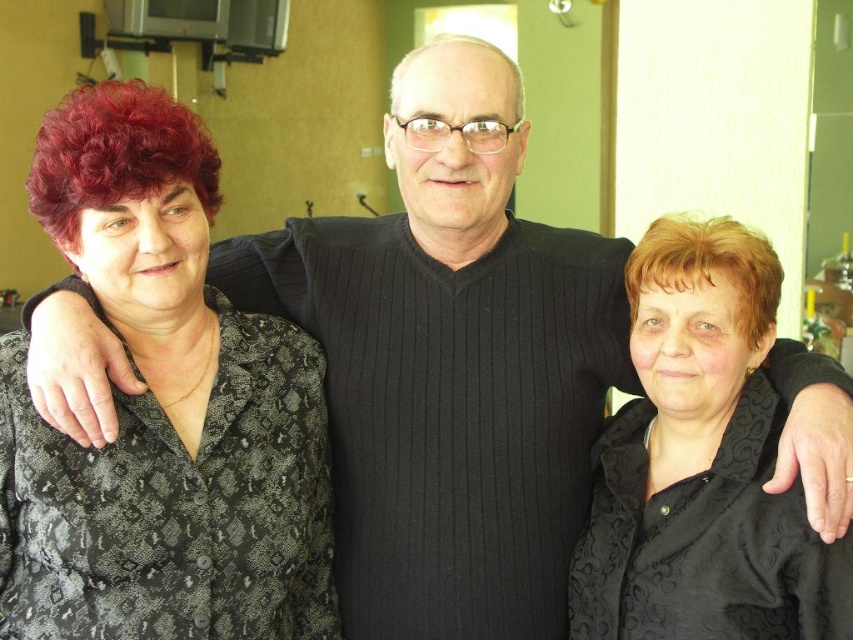
Question: Is black textured blouse at left to the right of black textured blouse at right from the viewer's perspective?

Choices:
 (A) no
 (B) yes

Answer: (A)

Question: Among these points, which one is farthest from the camera?

Choices:
 (A) coord(775,573)
 (B) coord(177,483)

Answer: (B)

Question: Is black textured blouse at left wider than black textured blouse at right?

Choices:
 (A) no
 (B) yes

Answer: (B)

Question: Which of the following is the farthest from the observer?

Choices:
 (A) (140, 208)
 (B) (657, 598)

Answer: (B)

Question: Where is black textured blouse at left located in relation to black textured blouse at right in the image?

Choices:
 (A) below
 (B) above

Answer: (B)